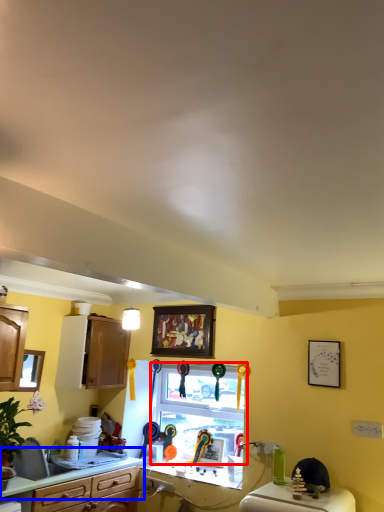
Question: Which of the following is the closest to the observer, window (highlighted by a red box) or countertop (highlighted by a blue box)?

Choices:
 (A) window
 (B) countertop

Answer: (B)